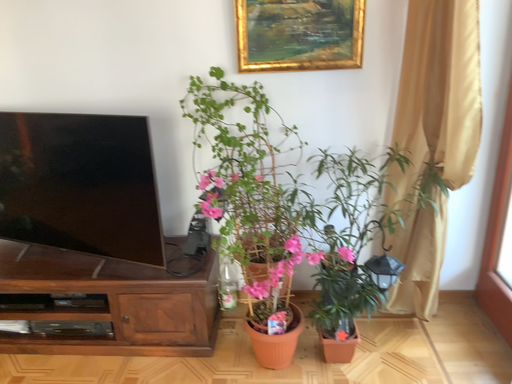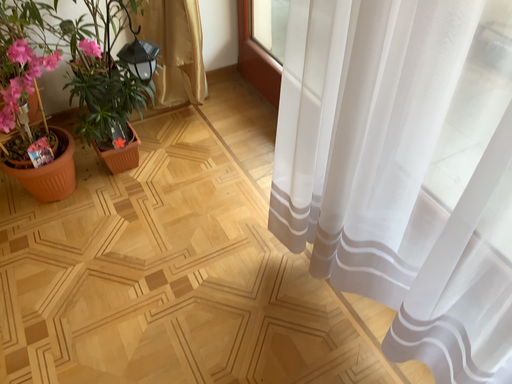
Question: Which way did the camera rotate in the video?

Choices:
 (A) rotated left
 (B) rotated right

Answer: (B)